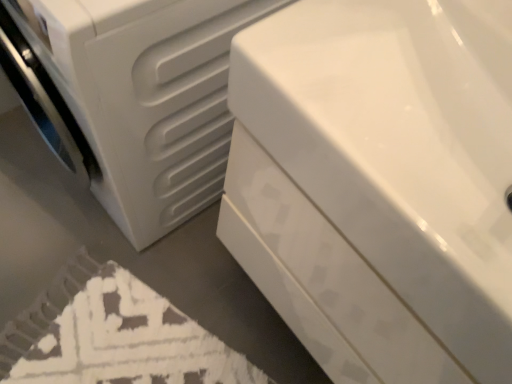
The width and height of the screenshot is (512, 384). In order to click on vacant area on the back side of white textured bath mat at lower left in this screenshot , I will do `click(172, 267)`.